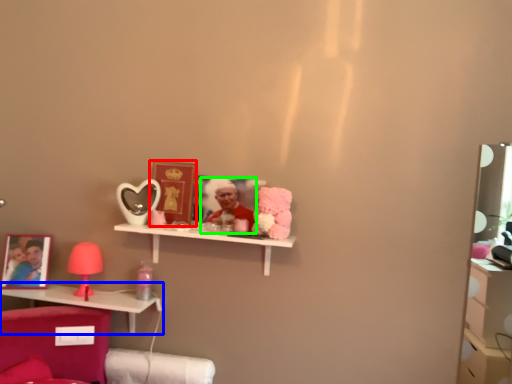
Question: Estimate the real-world distances between objects in this image. Which object is closer to picture frame (highlighted by a red box), shelf (highlighted by a blue box) or person (highlighted by a green box)?

Choices:
 (A) shelf
 (B) person

Answer: (B)